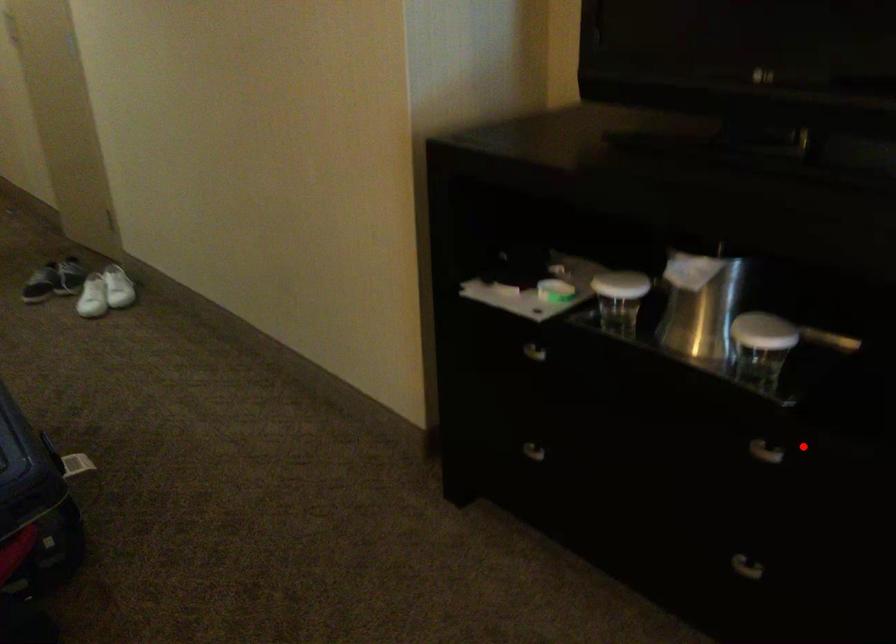
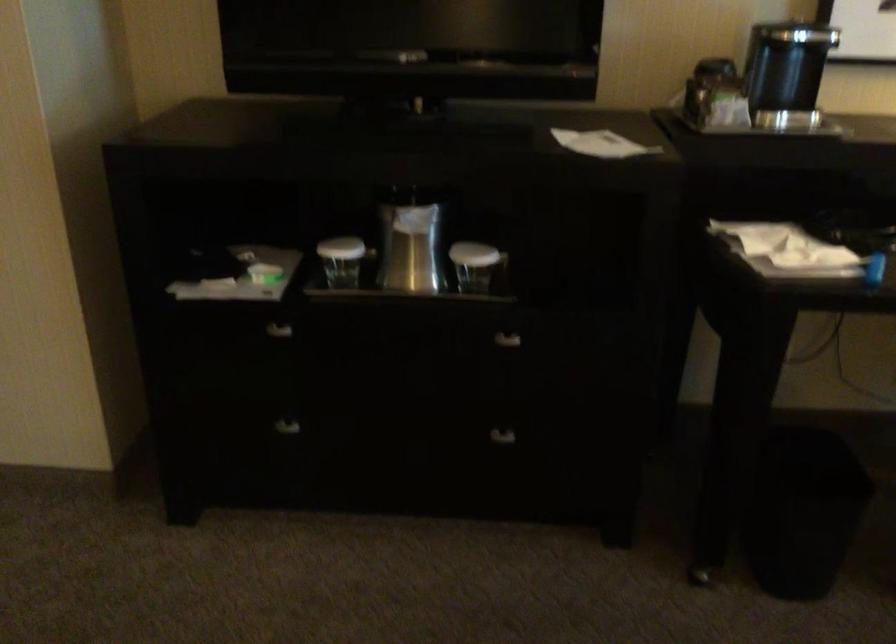
Question: I am providing you with two images of the same scene from different viewpoints. Image1 has a red point marked. In image2, the corresponding 3D location appears at what relative position? Reply with the corresponding letter.

Choices:
 (A) Closer
 (B) Farther

Answer: (B)